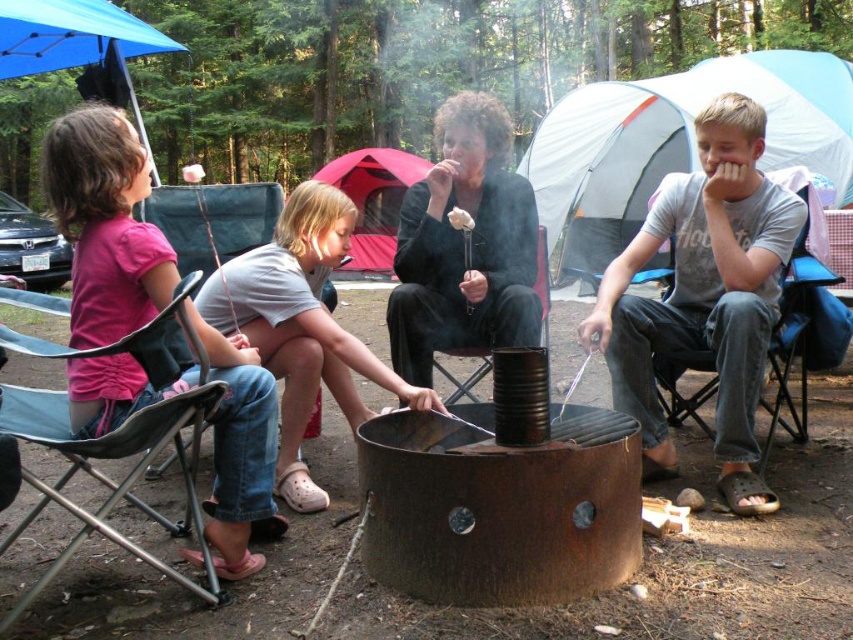
You are standing in the campsite and see the black matte jacket at center and the blue fabric chair at left. Which object is positioned higher relative to the other?

The black matte jacket at center is above the blue fabric chair at left, so it is positioned higher.

Based on the scene description, what object is located at the coordinates point (732, 186)?

The point (732, 186) corresponds to the matte black jacket at center.

You are standing in front of the campfire scene and want to take a photo. There are two points marked in the image, point (445,202) and point (173,209). Which point would appear larger in your photo?

Point (445,202) is closer to the camera than point (173,209), so it would appear larger in the photo.